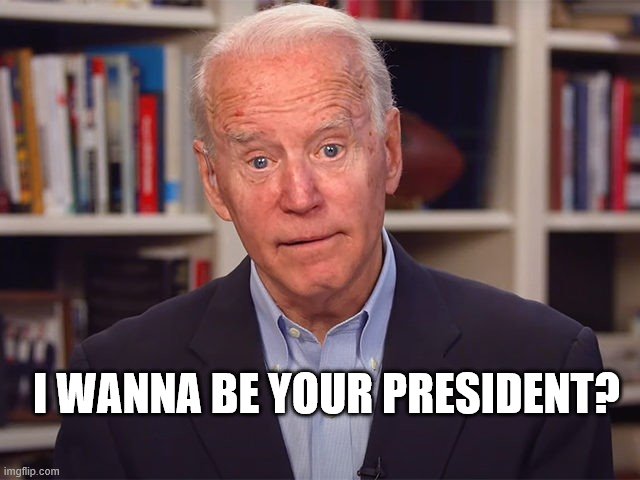
Locate an element on the screen. bookcase is located at coordinates (536, 253), (237, 4).